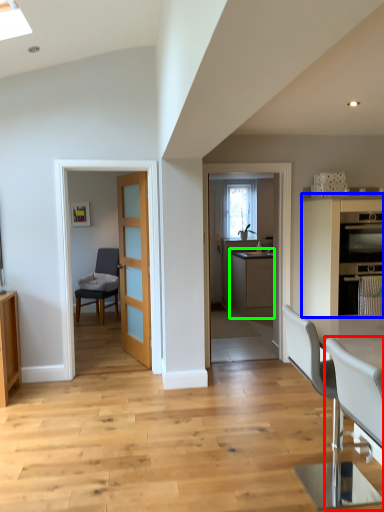
Question: Considering the real-world distances, which object is farthest from chair (highlighted by a red box)? cabinetry (highlighted by a blue box) or cabinetry (highlighted by a green box)?

Choices:
 (A) cabinetry
 (B) cabinetry

Answer: (B)